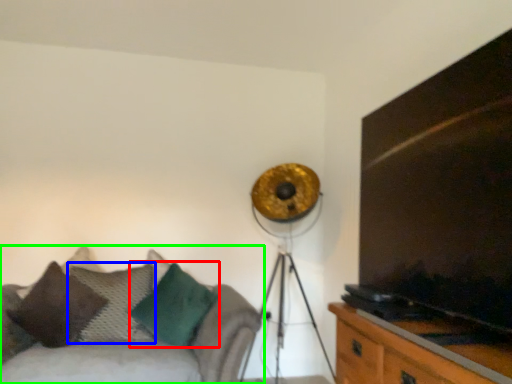
Question: Estimate the real-world distances between objects in this image. Which object is closer to pillow (highlighted by a red box), pillow (highlighted by a blue box) or studio couch (highlighted by a green box)?

Choices:
 (A) pillow
 (B) studio couch

Answer: (A)